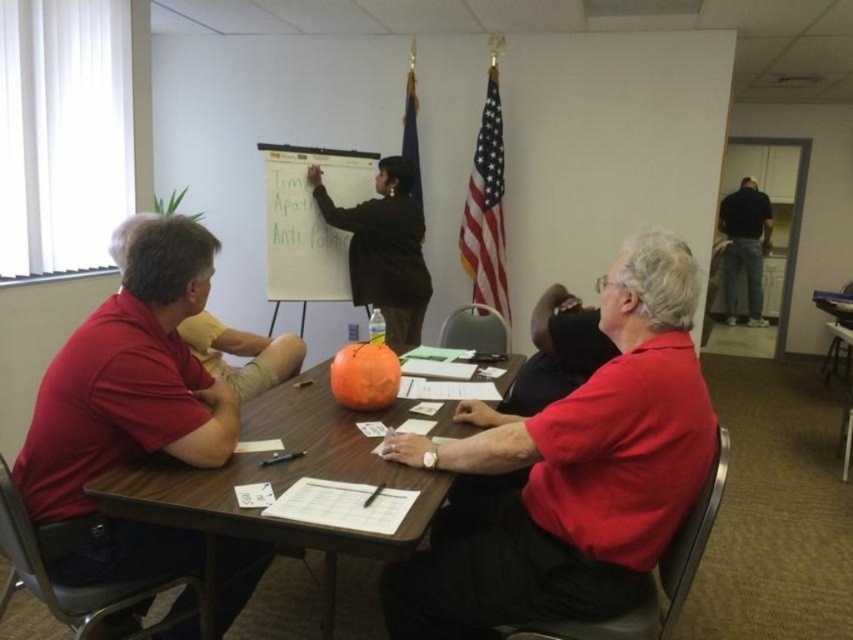
Question: Is matte red shirt at left thinner than black matte dress at upper center?

Choices:
 (A) yes
 (B) no

Answer: (A)

Question: Is red matte shirt at center smaller than wooden table at center?

Choices:
 (A) no
 (B) yes

Answer: (B)

Question: Does matte red shirt at left appear over whiteboard at upper center?

Choices:
 (A) no
 (B) yes

Answer: (A)

Question: Which object appears farthest from the camera in this image?

Choices:
 (A) black smooth shirt at upper right
 (B) whiteboard at upper center

Answer: (A)

Question: Among these objects, which one is nearest to the camera?

Choices:
 (A) wooden table at center
 (B) black smooth shirt at upper right
 (C) black matte dress at upper center
 (D) whiteboard at upper center

Answer: (A)

Question: Among these objects, which one is nearest to the camera?

Choices:
 (A) wooden table at center
 (B) black smooth shirt at upper right
 (C) red matte shirt at center
 (D) whiteboard at upper center

Answer: (A)